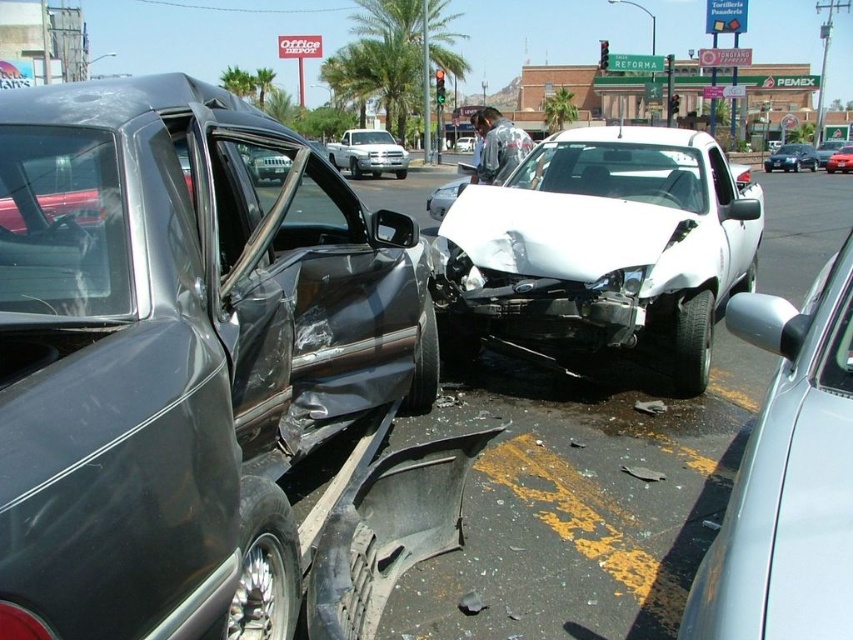
Who is higher up, matte black car at left or satin silver car at right?

matte black car at left is higher up.

Who is more forward, (78, 467) or (723, 612)?

Positioned in front is point (723, 612).

I want to click on matte black car at left, so click(x=180, y=355).

Does matte black car at left have a greater height compared to metallic silver sedan at center?

In fact, matte black car at left may be shorter than metallic silver sedan at center.

Is matte black car at left below metallic silver sedan at center?

Correct, matte black car at left is located below metallic silver sedan at center.

Where is `matte black car at left`? Image resolution: width=853 pixels, height=640 pixels. matte black car at left is located at coordinates (180, 355).

Can you confirm if matte black car at left is smaller than metallic red sedan at center?

Yes, matte black car at left is smaller than metallic red sedan at center.

Can you confirm if matte black car at left is positioned to the right of metallic red sedan at center?

In fact, matte black car at left is to the left of metallic red sedan at center.

Between point (117, 333) and point (834, 152), which one is positioned in front?

Point (117, 333) is in front.

Locate an element on the screen. The width and height of the screenshot is (853, 640). matte black car at left is located at coordinates (180, 355).